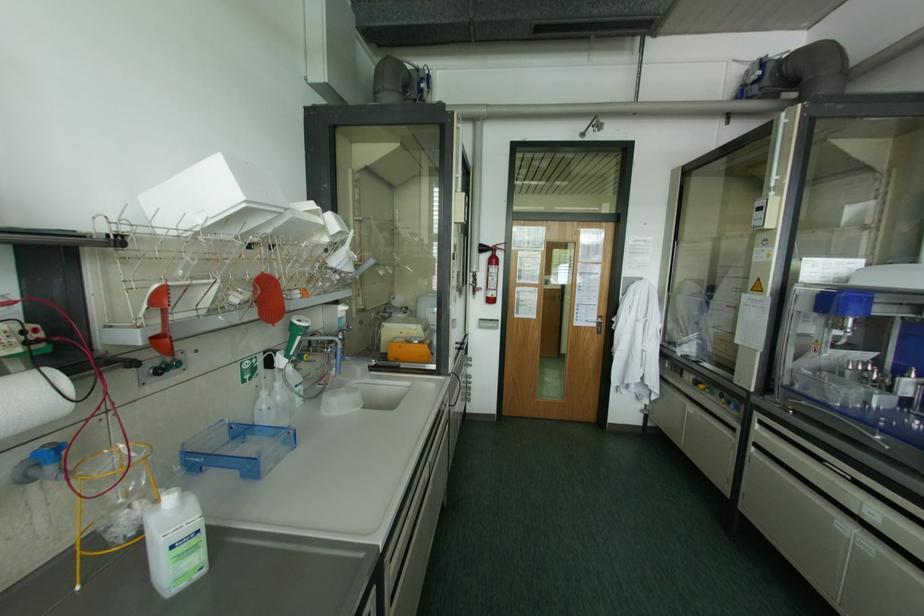
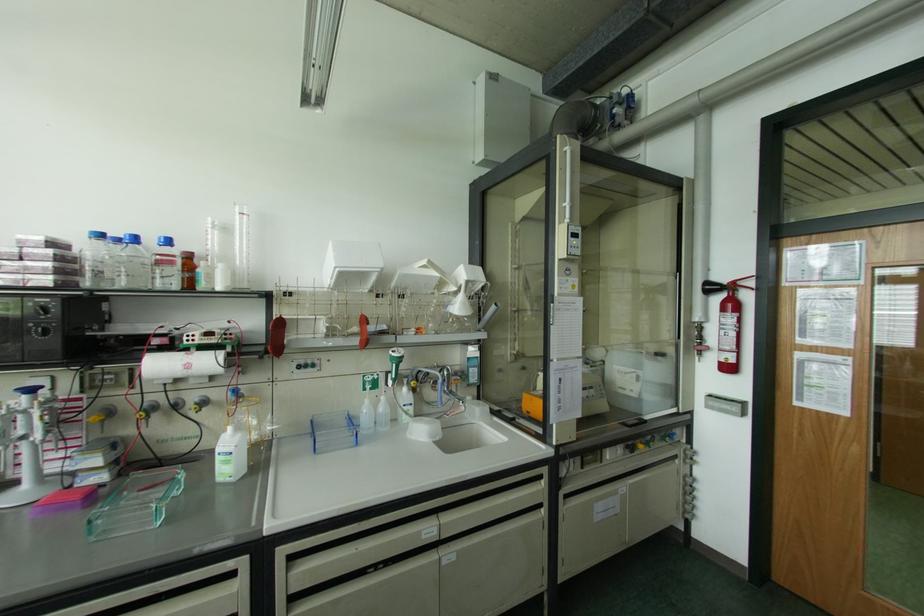
Find the pixel in the second image that matches the point at 493,248 in the first image.

(732, 286)